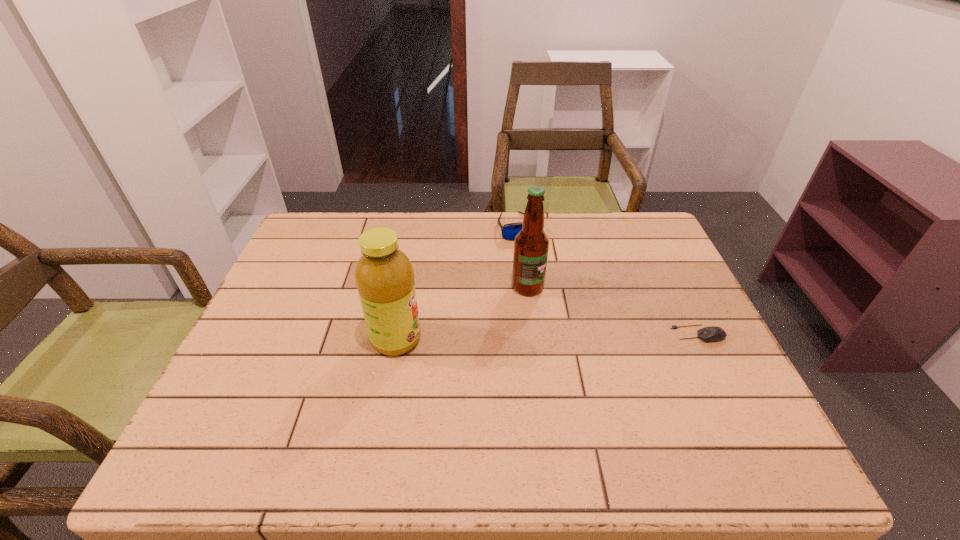
Point out which object is positioned as the third nearest to the beer bottle. Please provide its 2D coordinates. Your answer should be formatted as a tuple, i.e. [(x, y)], where the tuple contains the x and y coordinates of a point satisfying the conditions above.

[(714, 333)]

Find the location of `vacant area that satisfies the following two spatial constraints: 1. on the front side of the shortest object; 2. on the left side of the third nearest object`. vacant area that satisfies the following two spatial constraints: 1. on the front side of the shortest object; 2. on the left side of the third nearest object is located at coordinates (534, 334).

Image resolution: width=960 pixels, height=540 pixels. Identify the location of free spot that satisfies the following two spatial constraints: 1. on the front side of the beer bottle; 2. on the left side of the shortest object. (534, 334).

Where is `vacant area in the image that satisfies the following two spatial constraints: 1. on the front side of the farthest object; 2. on the right side of the rightmost object`? This screenshot has width=960, height=540. vacant area in the image that satisfies the following two spatial constraints: 1. on the front side of the farthest object; 2. on the right side of the rightmost object is located at coordinates (530, 334).